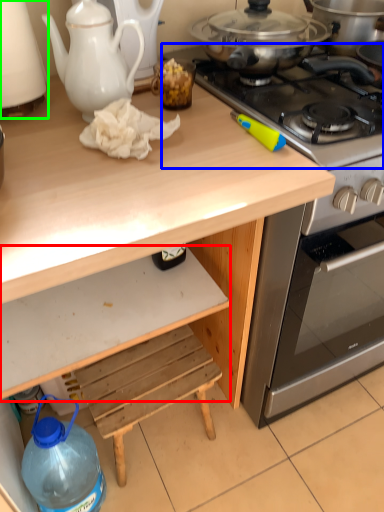
Question: Which is nearer to the drawer (highlighted by a red box)? gas stove (highlighted by a blue box) or kitchen appliance (highlighted by a green box).

Choices:
 (A) gas stove
 (B) kitchen appliance

Answer: (B)